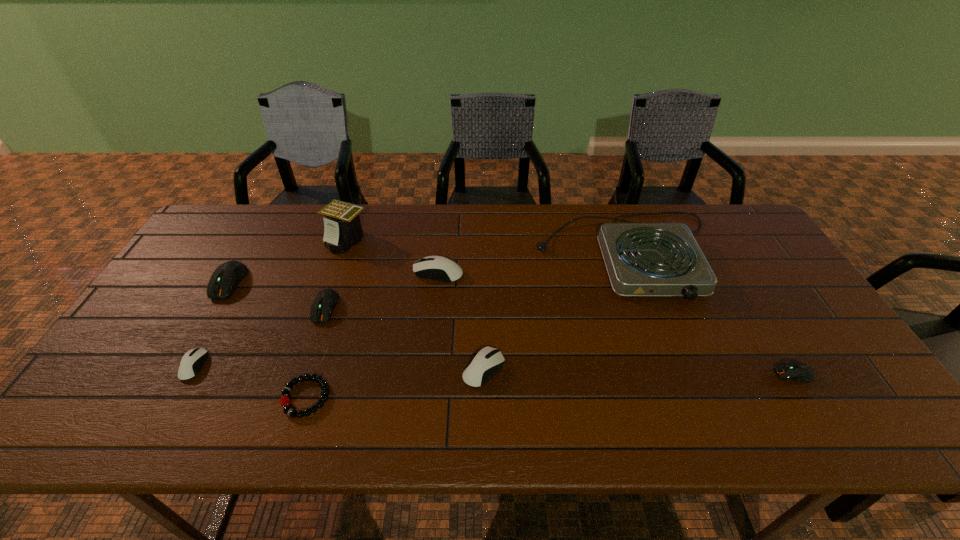
This screenshot has height=540, width=960. I want to click on free space located 0.160m on the right of the leftmost white mouse, so click(269, 366).

This screenshot has width=960, height=540. Identify the location of free region located 0.170m on the button of the nearest dark computer equipment. (705, 374).

Find the location of a particular element. This screenshot has width=960, height=540. free spot located on the button of the nearest dark computer equipment is located at coordinates 660,374.

Locate an element on the screen. Image resolution: width=960 pixels, height=540 pixels. vacant space located 0.360m on the button of the nearest dark computer equipment is located at coordinates (626, 374).

The image size is (960, 540). What are the coordinates of `free space located 0.390m on the back of the shortest object` in the screenshot? It's located at (348, 267).

The image size is (960, 540). I want to click on calculator that is at the far edge, so click(x=342, y=228).

Find the location of a particular element. The height and width of the screenshot is (540, 960). hotplate that is positioned at the far edge is located at coordinates (642, 259).

Find the location of a particular element. object present at the near edge is located at coordinates (285, 400).

You are a GUI agent. You are given a task and a screenshot of the screen. Output one action in this format:
    pyautogui.click(x=<x>, y=<y>)
    Task: Click on the object at the left edge
    Image resolution: width=960 pixels, height=540 pixels.
    Given the screenshot: What is the action you would take?
    pyautogui.click(x=224, y=280)

Locate an element on the screen. hotplate at the right edge is located at coordinates (642, 259).